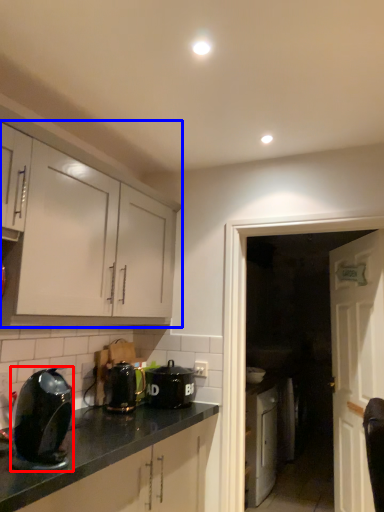
Question: Which object is further to the camera taking this photo, kitchen appliance (highlighted by a red box) or cabinetry (highlighted by a blue box)?

Choices:
 (A) kitchen appliance
 (B) cabinetry

Answer: (B)